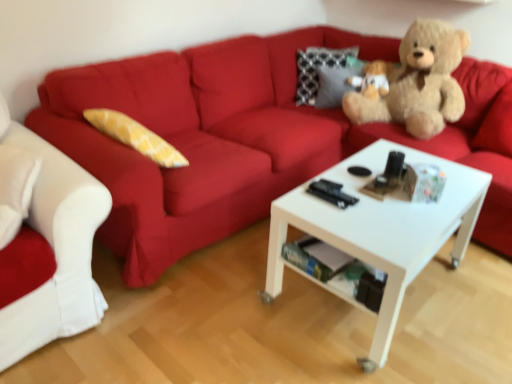
Question: Considering the relative positions of soft brown teddy bear at upper right and matte red couch at upper center, marked as the first studio couch in a right-to-left arrangement, in the image provided, is soft brown teddy bear at upper right to the left of matte red couch at upper center, marked as the first studio couch in a right-to-left arrangement, from the viewer's perspective?

Choices:
 (A) yes
 (B) no

Answer: (B)

Question: From a real-world perspective, is soft brown teddy bear at upper right physically above matte red couch at upper center, arranged as the 2th studio couch when viewed from the left?

Choices:
 (A) yes
 (B) no

Answer: (A)

Question: Can you confirm if soft brown teddy bear at upper right is bigger than matte red couch at upper center, arranged as the 2th studio couch when viewed from the left?

Choices:
 (A) no
 (B) yes

Answer: (A)

Question: Can you confirm if soft brown teddy bear at upper right is wider than matte red couch at upper center, marked as the first studio couch in a right-to-left arrangement?

Choices:
 (A) no
 (B) yes

Answer: (A)

Question: Is the position of soft brown teddy bear at upper right more distant than that of matte red couch at upper center, arranged as the 2th studio couch when viewed from the left?

Choices:
 (A) yes
 (B) no

Answer: (A)

Question: Is soft brown teddy bear at upper right smaller than matte red couch at upper center, arranged as the 2th studio couch when viewed from the left?

Choices:
 (A) yes
 (B) no

Answer: (A)

Question: Can you confirm if white fabric couch at left, which is the first studio couch from left to right, is smaller than white matte coffee table at center?

Choices:
 (A) no
 (B) yes

Answer: (B)

Question: Considering the relative positions of white fabric couch at left, which is the first studio couch from left to right, and white matte coffee table at center in the image provided, is white fabric couch at left, which is the first studio couch from left to right, to the right of white matte coffee table at center from the viewer's perspective?

Choices:
 (A) no
 (B) yes

Answer: (A)

Question: Can you confirm if white fabric couch at left, which is the first studio couch from left to right, is positioned to the left of white matte coffee table at center?

Choices:
 (A) yes
 (B) no

Answer: (A)

Question: From the image's perspective, is white fabric couch at left, which is the second studio couch in right-to-left order, located beneath white matte coffee table at center?

Choices:
 (A) yes
 (B) no

Answer: (B)

Question: Can you confirm if white fabric couch at left, which is the first studio couch from left to right, is wider than white matte coffee table at center?

Choices:
 (A) yes
 (B) no

Answer: (B)

Question: Can you confirm if white fabric couch at left, which is the second studio couch in right-to-left order, is taller than white matte coffee table at center?

Choices:
 (A) no
 (B) yes

Answer: (B)

Question: From a real-world perspective, does matte red couch at upper center, arranged as the 2th studio couch when viewed from the left, sit lower than white fabric couch at left, which is the second studio couch in right-to-left order?

Choices:
 (A) yes
 (B) no

Answer: (A)